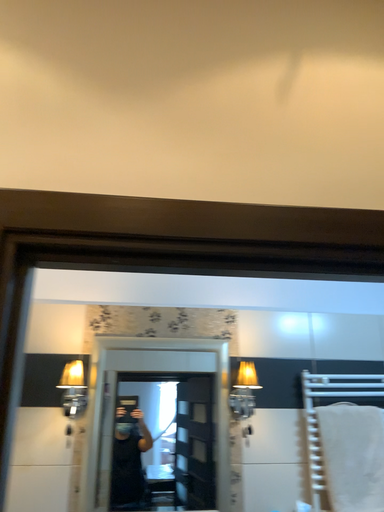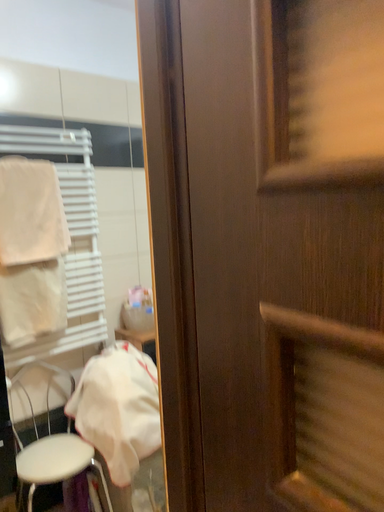
Question: Which way did the camera rotate in the video?

Choices:
 (A) rotated upward
 (B) rotated downward

Answer: (B)